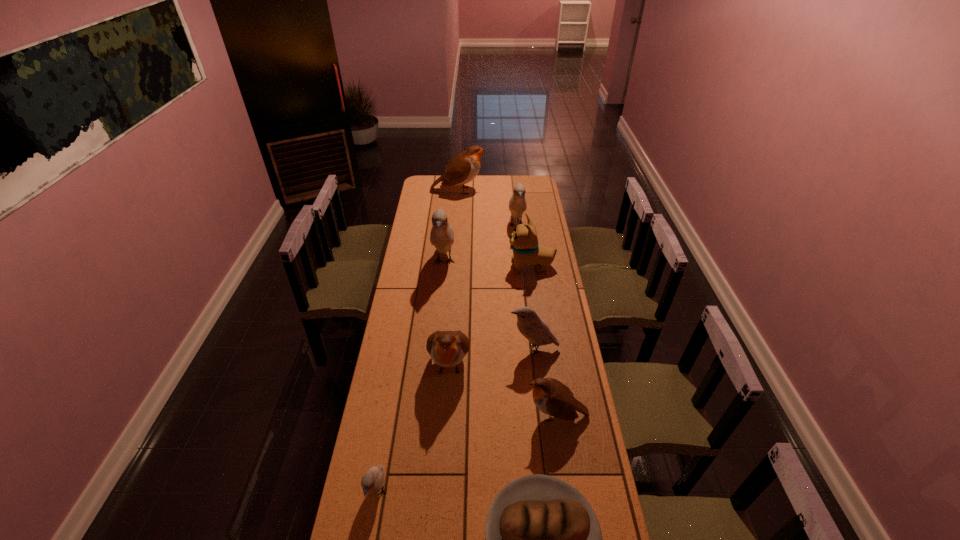
What are the coordinates of `bird that is the second closest to the smallest brown bird` in the screenshot? It's located at (531, 326).

The height and width of the screenshot is (540, 960). Find the location of `white bird that is the second closest to the bread`. white bird that is the second closest to the bread is located at coordinates (531, 326).

Identify the location of white bird object that ranks as the closest to the second smallest white bird. (442, 235).

Select which brown bird is the second closest to the leftmost white bird. Please provide its 2D coordinates. Your answer should be formatted as a tuple, i.e. [(x, y)], where the tuple contains the x and y coordinates of a point satisfying the conditions above.

[(552, 397)]

Locate which brown bird ranks in proximity to the farthest object. Please provide its 2D coordinates. Your answer should be formatted as a tuple, i.e. [(x, y)], where the tuple contains the x and y coordinates of a point satisfying the conditions above.

[(447, 349)]

At what (x,y) coordinates should I click in order to perform the action: click on free space in the image that satisfies the following two spatial constraints: 1. at the face of the farthest object; 2. at the beak of the tallest object. Please return your answer as a coordinate pair (x, y). Looking at the image, I should click on (453, 262).

Where is `vacant area that satisfies the following two spatial constraints: 1. at the face of the farthest object; 2. at the beak of the third farthest bird`? The image size is (960, 540). vacant area that satisfies the following two spatial constraints: 1. at the face of the farthest object; 2. at the beak of the third farthest bird is located at coordinates (453, 262).